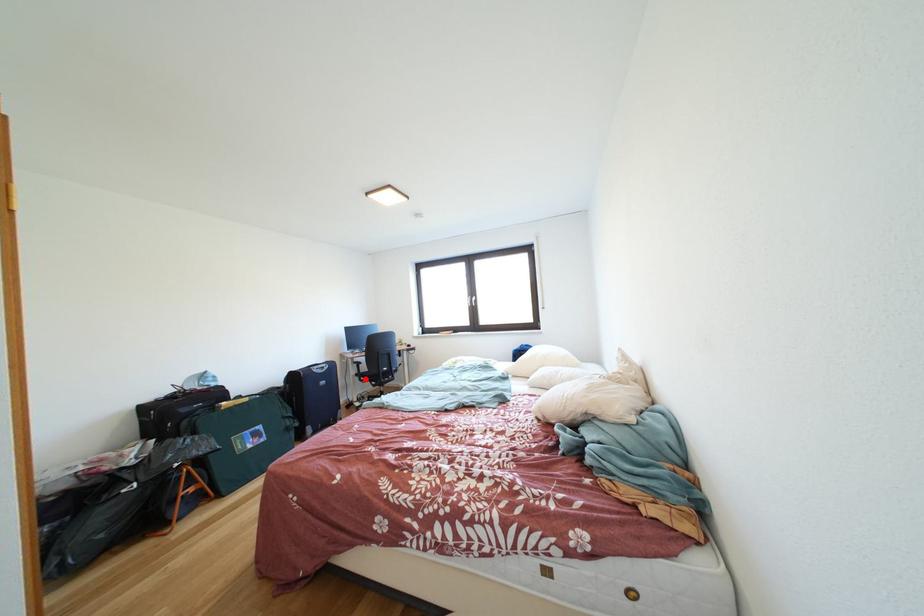
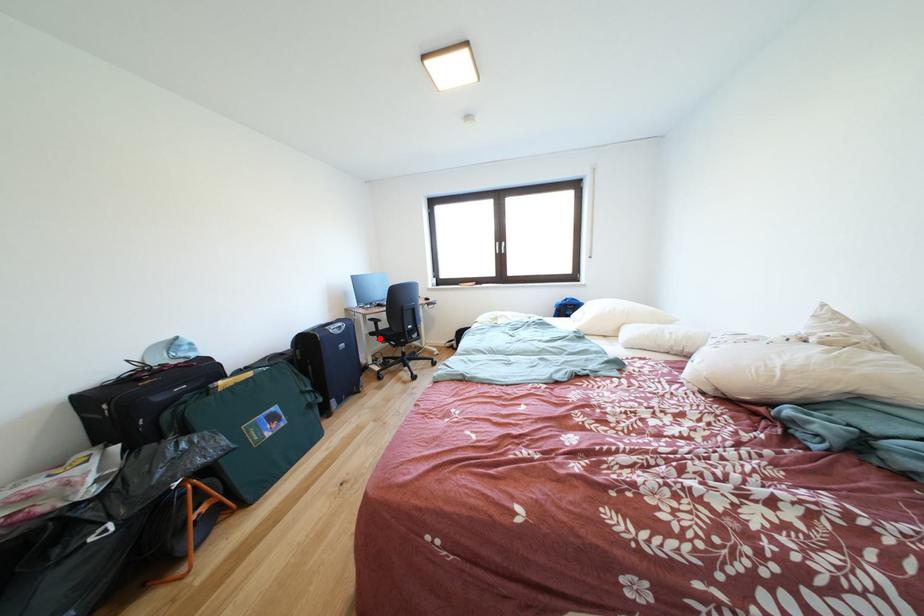
I am providing you with two images of the same scene from different viewpoints. A red point is marked on the first image and another point is marked on the second image. Does the point marked in image1 correspond to the same location as the one in image2?

Yes